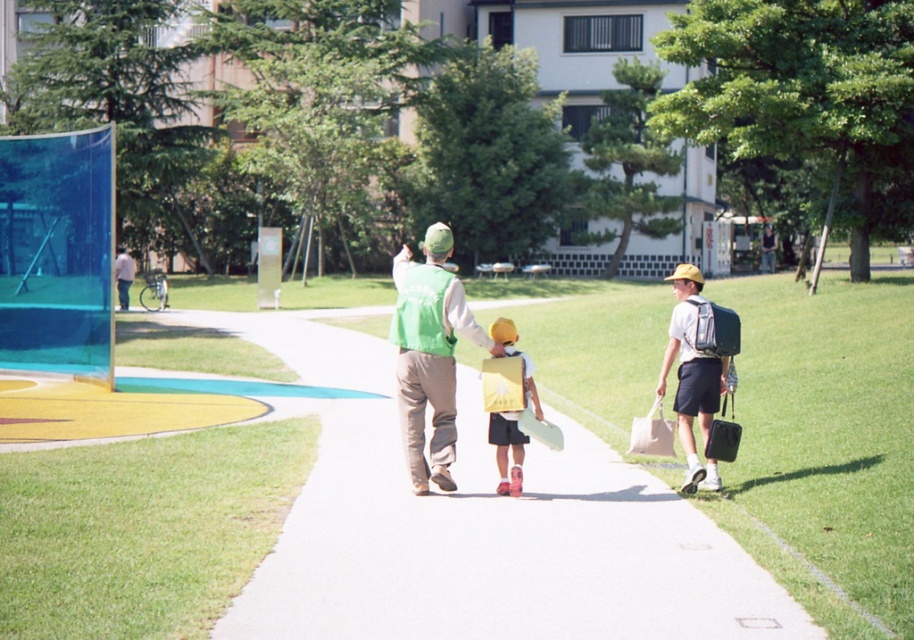
Does point (388, 605) come behind point (489, 348)?

No, (388, 605) is in front of (489, 348).

Which of these two, white smooth pavement at center or matte green vest at center, stands taller?

Standing taller between the two is matte green vest at center.

Describe the element at coordinates (476, 525) in the screenshot. This screenshot has width=914, height=640. I see `white smooth pavement at center` at that location.

You are a GUI agent. You are given a task and a screenshot of the screen. Output one action in this format:
    pyautogui.click(x=<x>, y=<y>)
    Task: Click on the white smooth pavement at center
    
    Given the screenshot: What is the action you would take?
    pyautogui.click(x=476, y=525)

Can you confirm if matte green vest at center is smaller than light blue fabric shirt at left?

Actually, matte green vest at center might be larger than light blue fabric shirt at left.

Where is `matte green vest at center`? This screenshot has width=914, height=640. matte green vest at center is located at coordinates (447, 365).

Identify the location of matte green vest at center. The image size is (914, 640). (447, 365).

At what (x,y) coordinates should I click in order to perform the action: click on matte green vest at center. Please return your answer as a coordinate pair (x, y). Looking at the image, I should click on (447, 365).

Does green fabric vest at center have a larger size compared to light blue fabric shirt at left?

Incorrect, green fabric vest at center is not larger than light blue fabric shirt at left.

Where is `green fabric vest at center`? The width and height of the screenshot is (914, 640). green fabric vest at center is located at coordinates pos(430,353).

Identify the location of green fabric vest at center. The height and width of the screenshot is (640, 914). (430, 353).